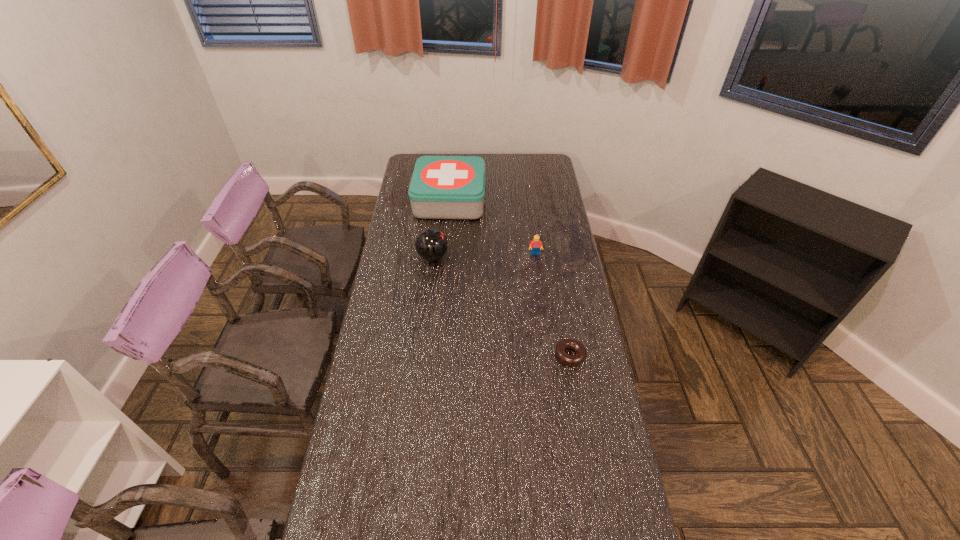
At what (x,y) coordinates should I click in order to perform the action: click on the farthest object. Please return your answer as a coordinate pair (x, y). Looking at the image, I should click on (442, 187).

Identify the location of bowling ball. (431, 244).

Locate an element on the screen. The width and height of the screenshot is (960, 540). Lego is located at coordinates click(535, 244).

This screenshot has width=960, height=540. I want to click on doughnut, so click(571, 360).

Where is `the fourth tallest object`? the fourth tallest object is located at coordinates (571, 360).

This screenshot has width=960, height=540. What are the coordinates of `free space located on the right of the farthest object` in the screenshot? It's located at click(516, 200).

Identify the location of vacant position located 0.400m on the surface of the bowling ball near the finger holes. The height and width of the screenshot is (540, 960). (543, 257).

Find the location of `vacant area situated 0.220m on the face of the third tallest object`. vacant area situated 0.220m on the face of the third tallest object is located at coordinates [x=540, y=294].

Locate an element on the screen. This screenshot has height=540, width=960. vacant space situated 0.220m on the front of the fourth tallest object is located at coordinates (583, 431).

This screenshot has width=960, height=540. Identify the location of the first-aid kit at the left edge. (442, 187).